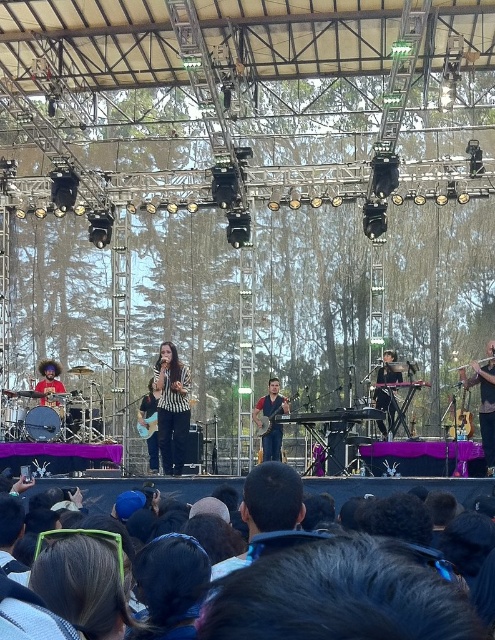
Question: Is dark hair at lower center thinner than striped fabric at center?

Choices:
 (A) yes
 (B) no

Answer: (B)

Question: Among these objects, which one is farthest from the camera?

Choices:
 (A) blue denim jeans at center
 (B) dark hair at lower center

Answer: (A)

Question: Based on their relative distances, which object is farther from the striped fabric at center?

Choices:
 (A) dark hair at lower center
 (B) blue denim jeans at center

Answer: (A)

Question: Can you confirm if striped fabric at center is positioned below blue denim jeans at center?

Choices:
 (A) yes
 (B) no

Answer: (B)

Question: Does striped fabric at center appear over wooden acoustic guitar at center?

Choices:
 (A) no
 (B) yes

Answer: (B)

Question: Which point is farther to the camera?

Choices:
 (A) striped fabric at center
 (B) wooden acoustic guitar at center
 (C) blue denim jeans at center

Answer: (C)